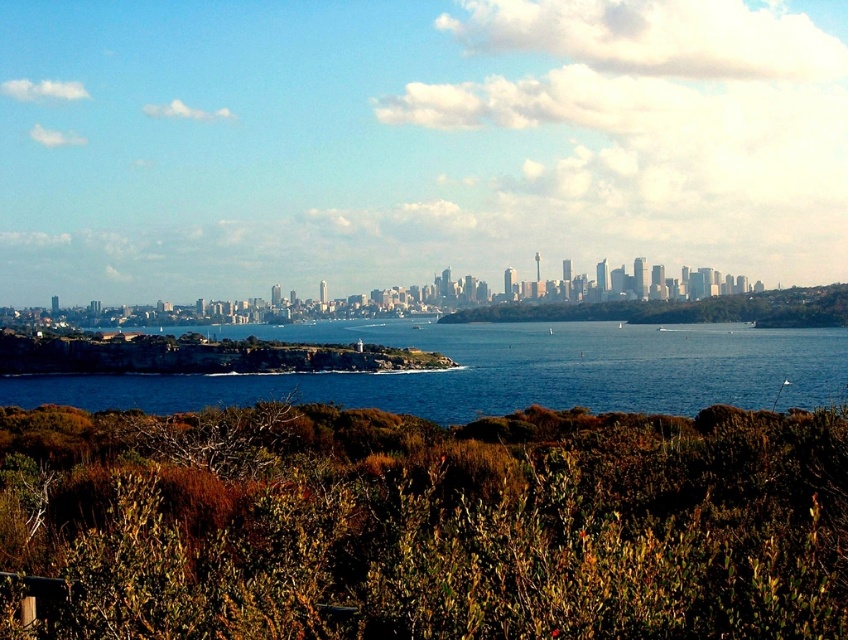
You are a landscape architect designing a walking path between the blue water at center and the green leafy shrubs at center. The path must be at least 200 feet long to accommodate all planned features. Based on the scene, will the available space between them suffice?

The distance between the blue water at center and the green leafy shrubs at center is 218.91 feet, which exceeds the required 200 feet. Therefore, the available space is sufficient to accommodate the planned walking path features.

From the picture: You are standing at the edge of the coastal cityscape looking out. You notice two green areas in front of you. The first is the green shrubbery at lower center, and the second is the green leafy shrubs at center. Which of these two areas has taller plants?

The green leafy shrubs at center are taller than the green shrubbery at lower center.